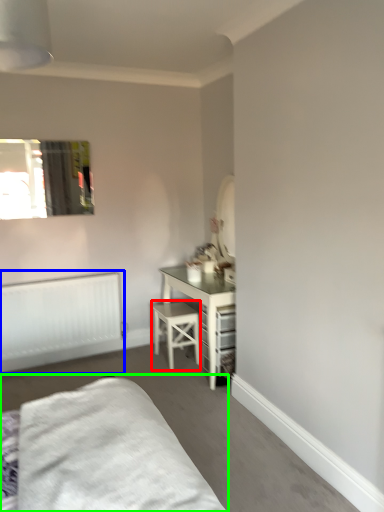
Question: Based on their relative distances, which object is farther from stool (highlighted by a red box)? Choose from radiator (highlighted by a blue box) and bed (highlighted by a green box).

Choices:
 (A) radiator
 (B) bed

Answer: (B)